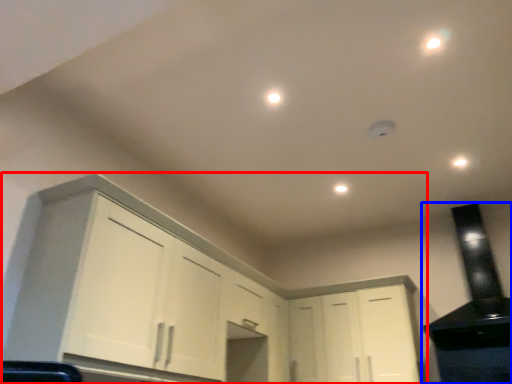
Question: Among these objects, which one is nearest to the camera, cabinetry (highlighted by a red box) or appliance (highlighted by a blue box)?

Choices:
 (A) cabinetry
 (B) appliance

Answer: (A)